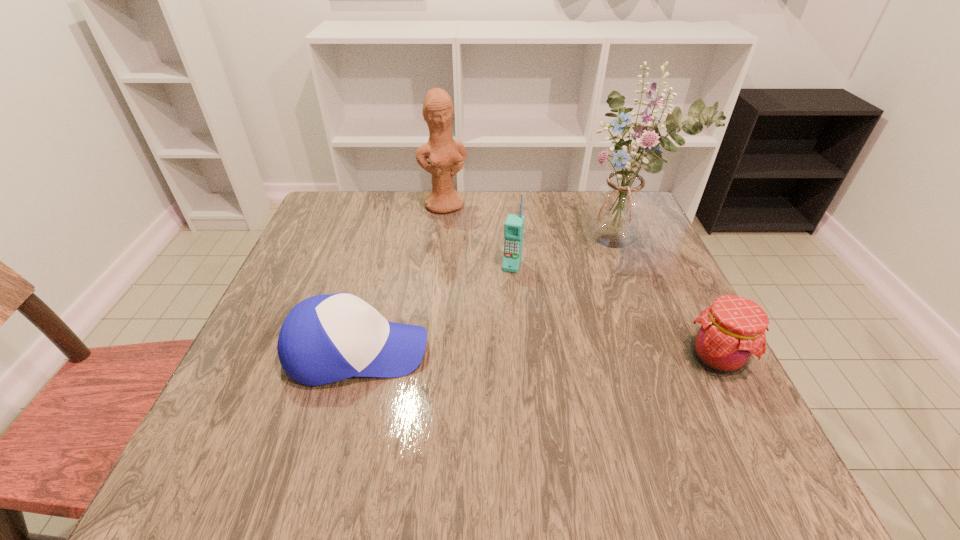
Where is `baseball cap`? The height and width of the screenshot is (540, 960). baseball cap is located at coordinates (327, 338).

Where is `jam`? jam is located at coordinates (730, 333).

The height and width of the screenshot is (540, 960). Find the location of `bouquet`. bouquet is located at coordinates (619, 208).

Locate an element on the screen. Image resolution: width=960 pixels, height=540 pixels. figurine is located at coordinates (446, 156).

Identify the location of cellular telephone. This screenshot has height=540, width=960. (514, 225).

Locate an element on the screen. the third shortest object is located at coordinates (514, 225).

The height and width of the screenshot is (540, 960). Identify the location of vacant space situated on the front-facing side of the baseball cap. (464, 352).

The width and height of the screenshot is (960, 540). What are the coordinates of `vacant region located 0.270m on the left of the jam` in the screenshot? It's located at (546, 358).

Locate an element on the screen. vacant space located on the front-facing side of the bouquet is located at coordinates (489, 364).

Find the location of a particular element. free point located on the front-facing side of the bouquet is located at coordinates (516, 341).